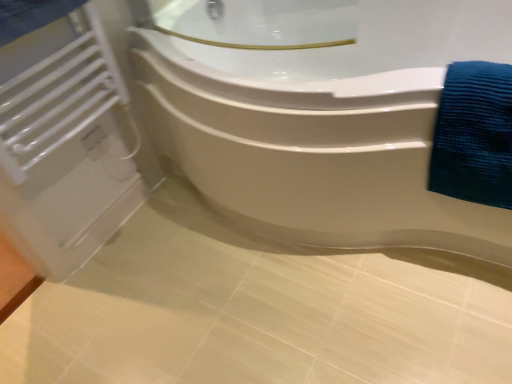
What do you see at coordinates (474, 135) in the screenshot?
I see `blue textured towel at right` at bounding box center [474, 135].

Find the location of a particular element. The image size is (512, 384). white matte radiator at left is located at coordinates (54, 88).

Which of these two, white glossy bathtub at upper center or white matte radiator at left, stands taller?

With more height is white glossy bathtub at upper center.

Identify the location of bathtub directly beneath the white matte radiator at left (from a real-world perspective). This screenshot has width=512, height=384. point(338,118).

From the image's perspective, which one is positioned higher, white glossy bathtub at upper center or white matte radiator at left?

From the image's view, white matte radiator at left is above.

From a real-world perspective, which object stands above the other?

white matte radiator at left, from a real-world perspective.

Is blue textured towel at right turned away from white glossy bathtub at upper center?

Yes.

From a real-world perspective, which object stands above the other?

In real-world perspective, blue textured towel at right is above.

Between blue textured towel at right and white glossy bathtub at upper center, which one has larger size?

With larger size is white glossy bathtub at upper center.

Does blue textured towel at right have a lesser height compared to white glossy bathtub at upper center?

Yes, blue textured towel at right is shorter than white glossy bathtub at upper center.

How different are the orientations of white glossy bathtub at upper center and blue textured towel at right in degrees?

The angle between the facing direction of white glossy bathtub at upper center and the facing direction of blue textured towel at right is 2.34 degrees.

Is blue textured towel at right located within white glossy bathtub at upper center?

Yes, blue textured towel at right is inside white glossy bathtub at upper center.

From a real-world perspective, which is physically below, white glossy bathtub at upper center or blue textured towel at right?

From a 3D spatial view, white glossy bathtub at upper center is below.

Is white glossy bathtub at upper center far from blue textured towel at right?

That's not correct — white glossy bathtub at upper center is a little close to blue textured towel at right.

Can you confirm if white matte radiator at left is taller than white glossy bathtub at upper center?

Incorrect, the height of white matte radiator at left is not larger of that of white glossy bathtub at upper center.

Does point (49, 33) come farther from viewer compared to point (464, 93)?

Yes.

Can you tell me how much white matte radiator at left and white glossy bathtub at upper center differ in facing direction?

white matte radiator at left and white glossy bathtub at upper center are facing 91.8 degrees away from each other.

Could you tell me if white matte radiator at left is facing blue textured towel at right?

Yes, white matte radiator at left is turned towards blue textured towel at right.

Between point (16, 134) and point (477, 146), which one is positioned behind?

Positioned behind is point (16, 134).

Is white matte radiator at left to the left or to the right of blue textured towel at right in the image?

white matte radiator at left is to the left of blue textured towel at right.

From the picture: Is white matte radiator at left shorter than blue textured towel at right?

Incorrect, the height of white matte radiator at left does not fall short of that of blue textured towel at right.

Considering the positions of objects blue textured towel at right and white matte radiator at left in the image provided, who is behind, blue textured towel at right or white matte radiator at left?

white matte radiator at left is further from the camera.

Does blue textured towel at right touch white matte radiator at left?

No.

Which of these two, blue textured towel at right or white matte radiator at left, stands taller?

white matte radiator at left is taller.

From a real-world perspective, which object stands above the other?

In real-world perspective, white matte radiator at left is above.

I want to click on bathtub below the white matte radiator at left (from a real-world perspective), so click(338, 118).

Where is `bathtub in front of the blue textured towel at right`? bathtub in front of the blue textured towel at right is located at coordinates (338, 118).

Which object lies further to the anchor point white matte radiator at left, blue textured towel at right or white glossy bathtub at upper center?

blue textured towel at right.

Looking at the image, which one is located further to blue textured towel at right, white glossy bathtub at upper center or white matte radiator at left?

white matte radiator at left is further to blue textured towel at right.

From the image, which object appears to be farther from blue textured towel at right, white matte radiator at left or white glossy bathtub at upper center?

white matte radiator at left lies further to blue textured towel at right than the other object.

Looking at the image, which one is located further to white matte radiator at left, white glossy bathtub at upper center or blue textured towel at right?

The object further to white matte radiator at left is blue textured towel at right.

Which object lies further to the anchor point white glossy bathtub at upper center, blue textured towel at right or white matte radiator at left?

Based on the image, white matte radiator at left appears to be further to white glossy bathtub at upper center.

When comparing their distances from white glossy bathtub at upper center, does white matte radiator at left or blue textured towel at right seem closer?

blue textured towel at right is closer to white glossy bathtub at upper center.

At what (x,y) coordinates should I click in order to perform the action: click on bathtub between white matte radiator at left and blue textured towel at right. Please return your answer as a coordinate pair (x, y). Looking at the image, I should click on (338, 118).